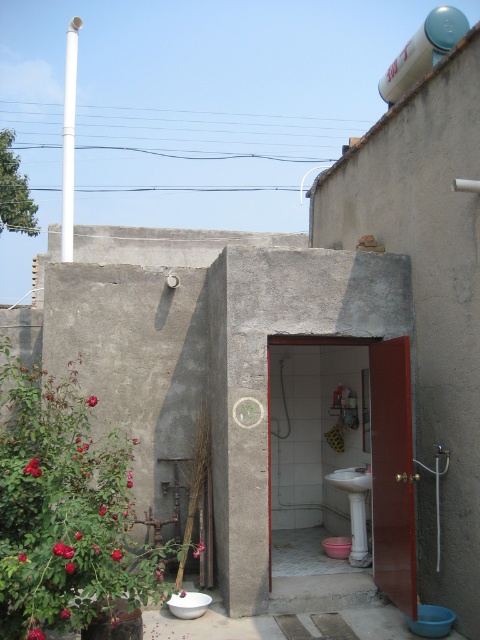
You are a painter who needs to paint both the matte concrete door at center and the white glossy toilet bowl at center. Which object will require more paint due to its height?

The matte concrete door at center is much taller than the white glossy toilet bowl at center, so it will require more paint.

You are standing at the entrance of the outdoor bathroom. Where exactly is the matte concrete door at center located in relation to your position?

The matte concrete door at center is located at point 0.455 on the x axis and 0.894 on the y axis relative to your position at the entrance.

You are a plumber inspecting the outdoor bathroom. You need to locate the white glossy water tank at upper right and the white glossy toilet bowl at lower center. According to their positions, which one is more to the right?

The white glossy water tank at upper right is positioned on the right side of the white glossy toilet bowl at lower center, so it is more to the right.